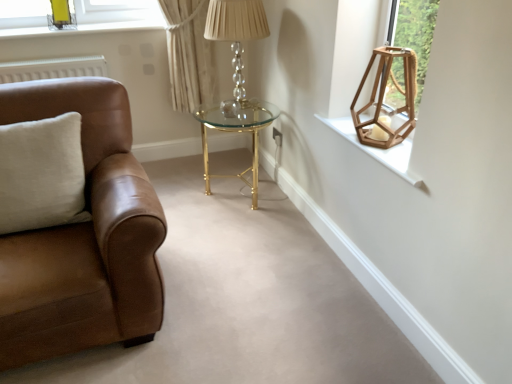
This screenshot has width=512, height=384. Describe the element at coordinates (236, 131) in the screenshot. I see `gold metallic/glass table at center` at that location.

What do you see at coordinates (41, 174) in the screenshot? I see `white cotton pillow at left` at bounding box center [41, 174].

Image resolution: width=512 pixels, height=384 pixels. I want to click on brown leather couch at left, so click(x=83, y=237).

This screenshot has height=384, width=512. I want to click on wooden hexagonal lantern at upper right, so click(x=379, y=150).

At what (x,y) coordinates should I click in order to perform the action: click on gold metallic/glass table at center. Please return your answer as a coordinate pair (x, y). Looking at the image, I should click on (236, 131).

In the scene shown: From the image's perspective, would you say white cotton pillow at left is positioned over brown leather couch at left?

Yes, from the image's perspective, white cotton pillow at left is over brown leather couch at left.

How far apart are white cotton pillow at left and brown leather couch at left?

They are 20.83 centimeters apart.

Is there a large distance between white cotton pillow at left and brown leather couch at left?

No, white cotton pillow at left is not far from brown leather couch at left.

Is white cotton pillow at left located outside brown leather couch at left?

No, white cotton pillow at left is not entirely external to brown leather couch at left.

Which is correct: white cotton pillow at left is inside wooden hexagonal lantern at upper right, or outside of it?

white cotton pillow at left lies outside wooden hexagonal lantern at upper right.

Is white cotton pillow at left touching wooden hexagonal lantern at upper right?

There is a gap between white cotton pillow at left and wooden hexagonal lantern at upper right.

From the image's perspective, is white cotton pillow at left located above or below wooden hexagonal lantern at upper right?

Clearly, from the image's perspective, white cotton pillow at left is below wooden hexagonal lantern at upper right.

Considering the relative positions of brown leather couch at left and wooden hexagonal lantern at upper right, placed as the 2th lamp when sorted from top to bottom, in the image provided, is brown leather couch at left behind wooden hexagonal lantern at upper right, placed as the 2th lamp when sorted from top to bottom,?

No, the depth of brown leather couch at left is less than that of wooden hexagonal lantern at upper right, placed as the 2th lamp when sorted from top to bottom.

From the picture: Can you tell me how much brown leather couch at left and wooden hexagonal lantern at upper right, the 1th lamp in the front-to-back sequence, differ in facing direction?

There is a 90-degree angle between the facing directions of brown leather couch at left and wooden hexagonal lantern at upper right, the 1th lamp in the front-to-back sequence.

Would you say wooden hexagonal lantern at upper right, the first lamp positioned from the bottom, is part of brown leather couch at left's contents?

No, wooden hexagonal lantern at upper right, the first lamp positioned from the bottom, is not a part of brown leather couch at left.

From a real-world perspective, does brown leather couch at left sit lower than wooden hexagonal lantern at upper right, the first lamp positioned from the bottom?

Yes, from a real-world perspective, brown leather couch at left is under wooden hexagonal lantern at upper right, the first lamp positioned from the bottom.

From a real-world perspective, which is physically above, gold metallic/glass table at center or wooden hexagonal lantern at upper right, the 1th lamp positioned from the right?

wooden hexagonal lantern at upper right, the 1th lamp positioned from the right, is physically above.

Is gold metallic/glass table at center looking in the opposite direction of wooden hexagonal lantern at upper right, the 1th lamp positioned from the right?

gold metallic/glass table at center does not have its back to wooden hexagonal lantern at upper right, the 1th lamp positioned from the right.

Would you consider gold metallic/glass table at center to be distant from wooden hexagonal lantern at upper right, the 1th lamp in the front-to-back sequence?

No, gold metallic/glass table at center is not far from wooden hexagonal lantern at upper right, the 1th lamp in the front-to-back sequence.

From the image's perspective, between gold metallic/glass table at center and wooden hexagonal lantern at upper right, the 1th lamp in the front-to-back sequence, who is located below?

gold metallic/glass table at center is shown below in the image.

Which object is thinner, gold metallic/glass table at center or wooden hexagonal lantern at upper right?

wooden hexagonal lantern at upper right is thinner.

Is gold metallic/glass table at center inside the boundaries of wooden hexagonal lantern at upper right, or outside?

gold metallic/glass table at center is not enclosed by wooden hexagonal lantern at upper right.

Identify the location of table on the left side of wooden hexagonal lantern at upper right. This screenshot has height=384, width=512. (236, 131).

Looking at this image, is gold metallic/glass table at center looking in the opposite direction of wooden hexagonal lantern at upper right?

No, gold metallic/glass table at center is not facing away from wooden hexagonal lantern at upper right.

Is wooden hexagonal lantern at upper right, marked as the second lamp in a back-to-front arrangement, oriented away from wooden hexagonal lantern at upper right?

No, wooden hexagonal lantern at upper right, marked as the second lamp in a back-to-front arrangement,'s orientation is not away from wooden hexagonal lantern at upper right.

In the scene shown: Is wooden hexagonal lantern at upper right surrounded by wooden hexagonal lantern at upper right, placed as the 2th lamp when sorted from top to bottom?

No, wooden hexagonal lantern at upper right is not a part of wooden hexagonal lantern at upper right, placed as the 2th lamp when sorted from top to bottom.

Which object is closer to the camera taking this photo, wooden hexagonal lantern at upper right, the first lamp positioned from the bottom, or wooden hexagonal lantern at upper right?

wooden hexagonal lantern at upper right is closer to the camera.

Which object is more forward, crystal glass table lamp at center or metallic gold lamp at upper left, marked as the first lamp in a top-to-bottom arrangement?

Positioned in front is crystal glass table lamp at center.

This screenshot has height=384, width=512. I want to click on table lamp below the metallic gold lamp at upper left, marked as the first lamp in a top-to-bottom arrangement (from the image's perspective), so click(x=236, y=32).

Does crystal glass table lamp at center have a lesser width compared to metallic gold lamp at upper left, marked as the first lamp in a top-to-bottom arrangement?

Incorrect, the width of crystal glass table lamp at center is not less than that of metallic gold lamp at upper left, marked as the first lamp in a top-to-bottom arrangement.

How different are the orientations of crystal glass table lamp at center and metallic gold lamp at upper left, which is the second lamp in front-to-back order, in degrees?

There is a 78.7-degree angle between the facing directions of crystal glass table lamp at center and metallic gold lamp at upper left, which is the second lamp in front-to-back order.

You are a GUI agent. You are given a task and a screenshot of the screen. Output one action in this format:
    pyautogui.click(x=<x>, y=<y>)
    Task: Click on the pillow behind the brown leather couch at left
    The image size is (512, 384).
    Given the screenshot: What is the action you would take?
    pyautogui.click(x=41, y=174)

Locate an element on the screen. The width and height of the screenshot is (512, 384). window sill located on the right of white cotton pillow at left is located at coordinates click(x=379, y=150).

From the image, which object appears to be farther from crystal glass table lamp at center, wooden hexagonal lantern at upper right or brown leather couch at left?

brown leather couch at left lies further to crystal glass table lamp at center than the other object.

Considering their positions, is wooden hexagonal lantern at upper right, the first lamp positioned from the bottom, positioned closer to wooden hexagonal lantern at upper right than white cotton pillow at left?

Based on the image, wooden hexagonal lantern at upper right, the first lamp positioned from the bottom, appears to be nearer to wooden hexagonal lantern at upper right.

Based on their spatial positions, is white cotton pillow at left or crystal glass table lamp at center closer to wooden hexagonal lantern at upper right, arranged as the 2th lamp when viewed from the left?

crystal glass table lamp at center is closer to wooden hexagonal lantern at upper right, arranged as the 2th lamp when viewed from the left.

From the image, which object appears to be farther from gold metallic/glass table at center, crystal glass table lamp at center or wooden hexagonal lantern at upper right, the 1th lamp in the front-to-back sequence?

wooden hexagonal lantern at upper right, the 1th lamp in the front-to-back sequence, is positioned further to the anchor gold metallic/glass table at center.

When comparing their distances from brown leather couch at left, does wooden hexagonal lantern at upper right, the first lamp positioned from the bottom, or wooden hexagonal lantern at upper right seem further?

→ wooden hexagonal lantern at upper right, the first lamp positioned from the bottom, is further to brown leather couch at left.

When comparing their distances from crystal glass table lamp at center, does gold metallic/glass table at center or brown leather couch at left seem further?

brown leather couch at left is further to crystal glass table lamp at center.

Which object lies further to the anchor point wooden hexagonal lantern at upper right, white cotton pillow at left or wooden hexagonal lantern at upper right, the 1th lamp in the front-to-back sequence?

Among the two, white cotton pillow at left is located further to wooden hexagonal lantern at upper right.

Which object lies further to the anchor point white cotton pillow at left, metallic gold lamp at upper left, marked as the first lamp in a top-to-bottom arrangement, or gold metallic/glass table at center?

metallic gold lamp at upper left, marked as the first lamp in a top-to-bottom arrangement.

Identify the location of table lamp situated between brown leather couch at left and wooden hexagonal lantern at upper right from left to right. (236, 32).

You are a GUI agent. You are given a task and a screenshot of the screen. Output one action in this format:
    pyautogui.click(x=<x>, y=<y>)
    Task: Click on the table between crystal glass table lamp at center and wooden hexagonal lantern at upper right, the 1th lamp positioned from the right, from left to right
    The image size is (512, 384).
    Given the screenshot: What is the action you would take?
    pyautogui.click(x=236, y=131)

You are a GUI agent. You are given a task and a screenshot of the screen. Output one action in this format:
    pyautogui.click(x=<x>, y=<y>)
    Task: Click on the window sill located between metallic gold lamp at upper left, which is counted as the first lamp, starting from the back, and wooden hexagonal lantern at upper right, the 1th lamp in the front-to-back sequence, in the left-right direction
    
    Given the screenshot: What is the action you would take?
    pyautogui.click(x=379, y=150)

Identify the location of table lamp located between brown leather couch at left and metallic gold lamp at upper left, arranged as the second lamp when viewed from the right, in the depth direction. tap(236, 32).